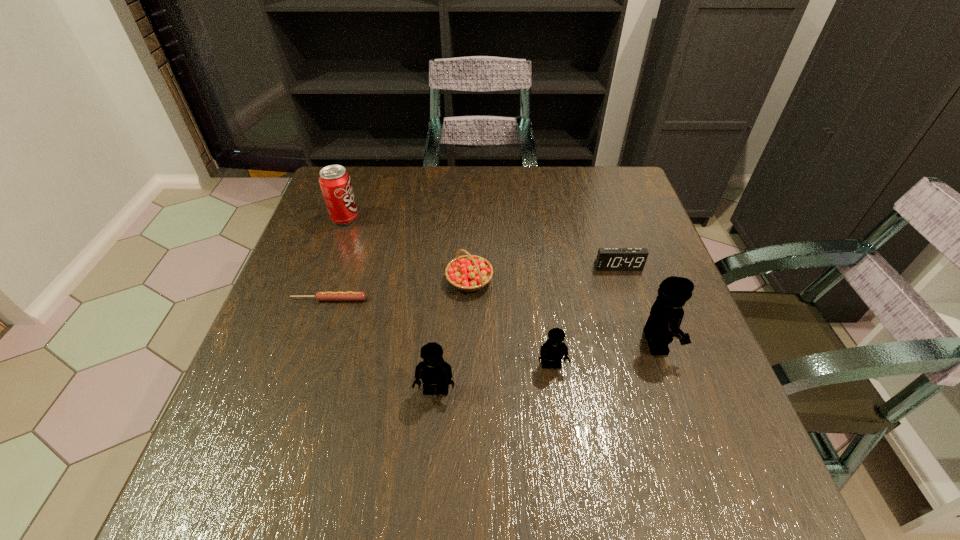
The image size is (960, 540). Find the location of `vacant point located between the second tallest Lego and the third object from right to left`. vacant point located between the second tallest Lego and the third object from right to left is located at coordinates (493, 377).

Where is `vacant region between the second shortest object and the third shortest object`? The height and width of the screenshot is (540, 960). vacant region between the second shortest object and the third shortest object is located at coordinates (543, 274).

Locate an element on the screen. The width and height of the screenshot is (960, 540). free spot between the alarm clock and the nearest Lego is located at coordinates (527, 328).

Identify the location of free space between the second shortest object and the fifth object from left to right. This screenshot has width=960, height=540. [585, 316].

Identify the location of free space between the strawberry and the second Lego from right to left. (511, 323).

Locate an element on the screen. The image size is (960, 540). free spot between the third object from right to left and the nearest Lego is located at coordinates (493, 377).

This screenshot has width=960, height=540. What are the coordinates of `empty space that is in between the alarm clock and the farthest object` in the screenshot? It's located at (481, 242).

Identify the location of vacant space that is in between the shortest object and the third shortest object. This screenshot has width=960, height=540. (399, 290).

Find the location of a particular element. vacant point located between the farthest object and the shortest object is located at coordinates (337, 259).

Identify which object is the fourth nearest to the nearest Lego. Please provide its 2D coordinates. Your answer should be formatted as a tuple, i.e. [(x, y)], where the tuple contains the x and y coordinates of a point satisfying the conditions above.

[(666, 314)]